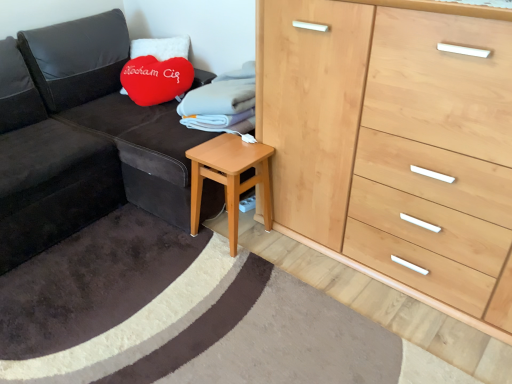
Question: Is natural wood chest of drawers at right looking in the opposite direction of light brown wooden stool at lower center?

Choices:
 (A) no
 (B) yes

Answer: (A)

Question: Is natural wood chest of drawers at right thinner than light brown wooden stool at lower center?

Choices:
 (A) no
 (B) yes

Answer: (A)

Question: Is natural wood chest of drawers at right positioned before light brown wooden stool at lower center?

Choices:
 (A) yes
 (B) no

Answer: (A)

Question: From a real-world perspective, is natural wood chest of drawers at right on light brown wooden stool at lower center?

Choices:
 (A) yes
 (B) no

Answer: (A)

Question: Is natural wood chest of drawers at right oriented towards light brown wooden stool at lower center?

Choices:
 (A) no
 (B) yes

Answer: (B)

Question: Can you confirm if natural wood chest of drawers at right is positioned to the right of light brown wooden stool at lower center?

Choices:
 (A) yes
 (B) no

Answer: (A)

Question: From a real-world perspective, is velvet dark gray couch at left below light brown wooden stool at lower center?

Choices:
 (A) no
 (B) yes

Answer: (A)

Question: From the image's perspective, does velvet dark gray couch at left appear higher than light brown wooden stool at lower center?

Choices:
 (A) no
 (B) yes

Answer: (B)

Question: Can you confirm if velvet dark gray couch at left is positioned to the right of light brown wooden stool at lower center?

Choices:
 (A) no
 (B) yes

Answer: (A)

Question: Is velvet dark gray couch at left placed right next to light brown wooden stool at lower center?

Choices:
 (A) no
 (B) yes

Answer: (A)

Question: Does velvet dark gray couch at left have a smaller size compared to light brown wooden stool at lower center?

Choices:
 (A) no
 (B) yes

Answer: (A)

Question: Is velvet dark gray couch at left further to the viewer compared to light brown wooden stool at lower center?

Choices:
 (A) no
 (B) yes

Answer: (A)

Question: Is natural wood chest of drawers at right located outside velvety red heart-shaped pillow at upper left?

Choices:
 (A) yes
 (B) no

Answer: (A)